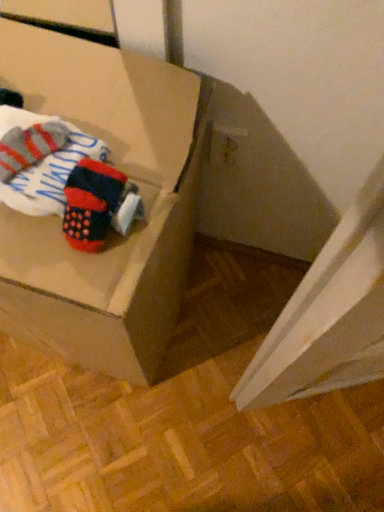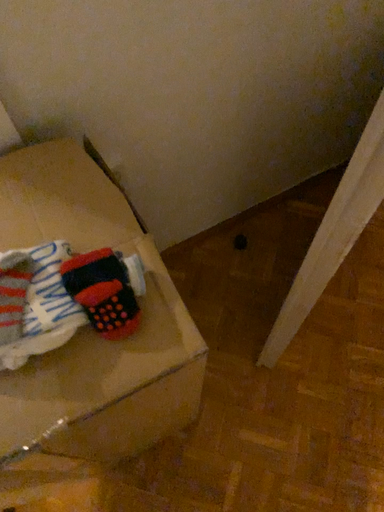
Question: How did the camera likely rotate when shooting the video?

Choices:
 (A) rotated upward
 (B) rotated downward

Answer: (A)